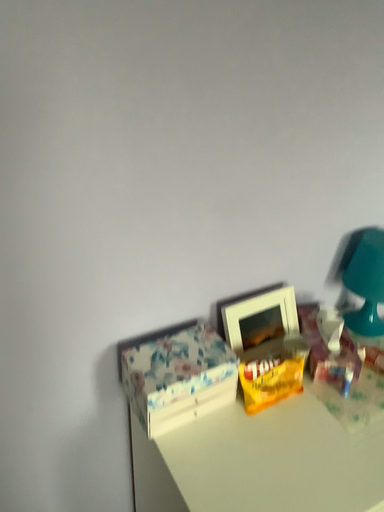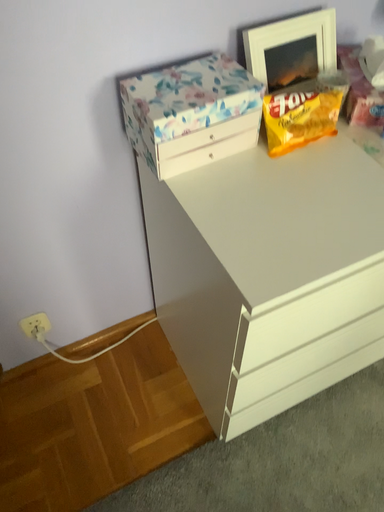
Question: How did the camera likely rotate when shooting the video?

Choices:
 (A) rotated upward
 (B) rotated downward

Answer: (B)